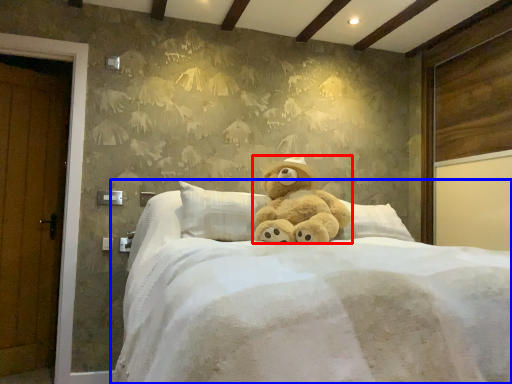
Question: Among these objects, which one is nearest to the camera, teddy bear (highlighted by a red box) or bed (highlighted by a blue box)?

Choices:
 (A) teddy bear
 (B) bed

Answer: (B)